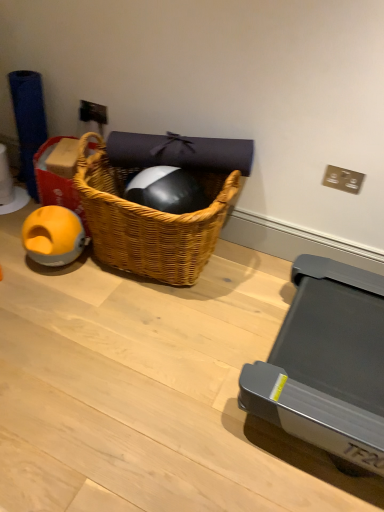
You are a GUI agent. You are given a task and a screenshot of the screen. Output one action in this format:
    pyautogui.click(x=<x>, y=<y>)
    Task: Click on the vacant area that lies to the right of orange rubber ball at left
    Image resolution: width=384 pixels, height=512 pixels.
    Given the screenshot: What is the action you would take?
    pyautogui.click(x=105, y=276)